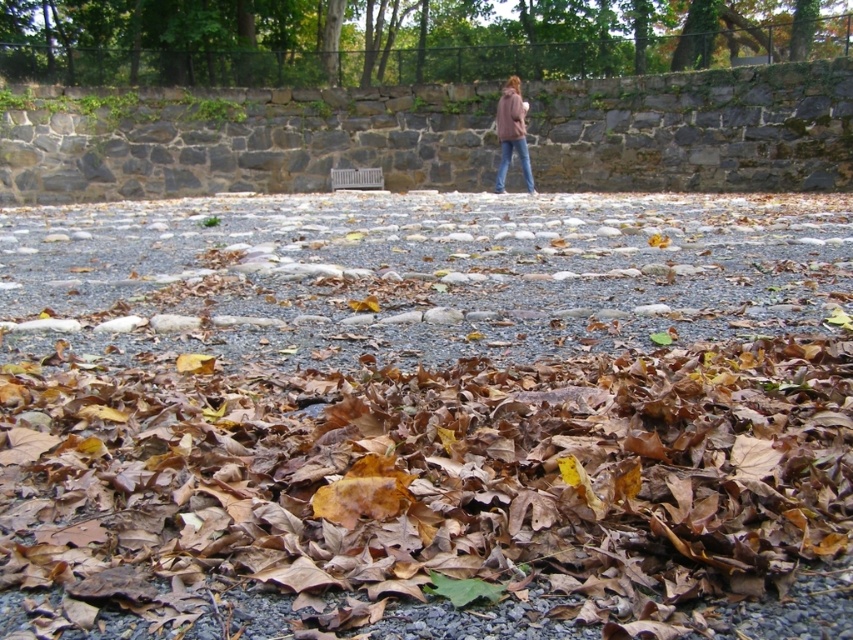
Question: Does brown leaf litter at upper center appear under matte pink hoodie at upper right?

Choices:
 (A) no
 (B) yes

Answer: (A)

Question: Among these points, which one is nearest to the camera?

Choices:
 (A) (527, 188)
 (B) (527, 186)

Answer: (B)

Question: Is brown leaf litter at upper center in front of blue jeans at center?

Choices:
 (A) no
 (B) yes

Answer: (A)

Question: Which of the following is the farthest from the observer?

Choices:
 (A) brown leaf litter at upper center
 (B) blue jeans at center

Answer: (A)

Question: Does brown leaf litter at upper center appear on the right side of matte pink hoodie at upper right?

Choices:
 (A) no
 (B) yes

Answer: (A)

Question: Considering the real-world distances, which object is closest to the blue jeans at center?

Choices:
 (A) brown leaf litter at upper center
 (B) matte pink hoodie at upper right
 (C) brown dried leaves at center

Answer: (B)